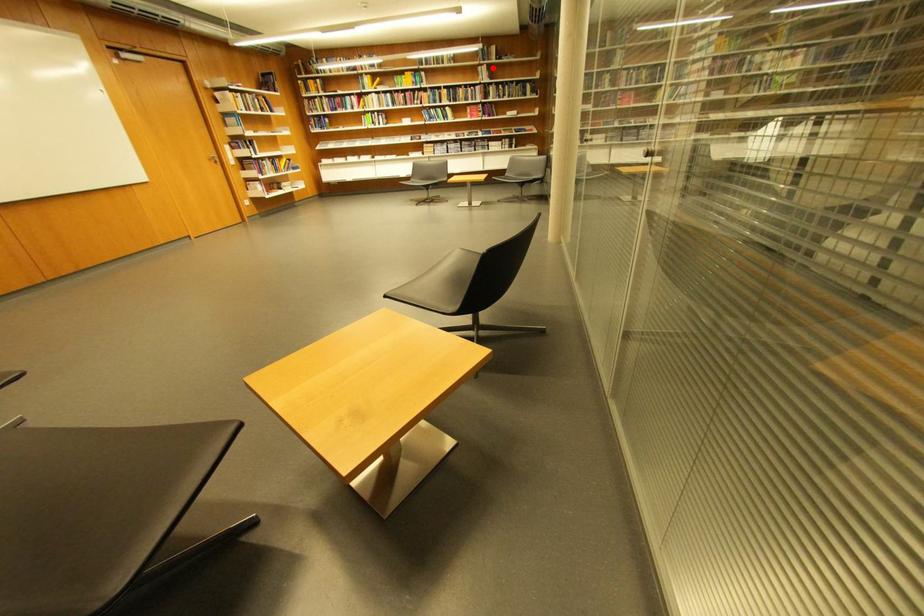
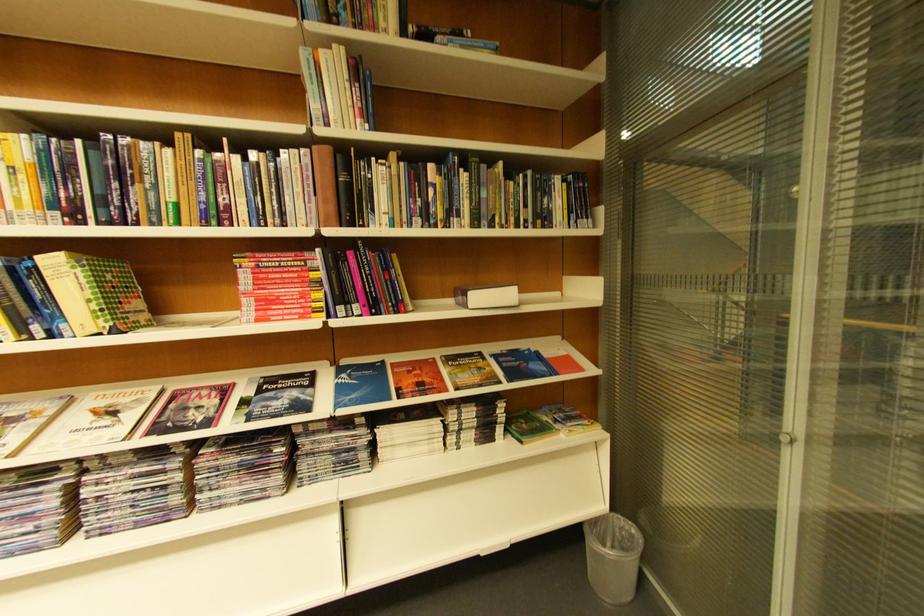
Question: I am providing you with two images of the same scene from different viewpoints. Given a red point in image1, look at the same physical point in image2. Is it:

Choices:
 (A) Closer to the viewpoint
 (B) Farther from the viewpoint

Answer: (B)